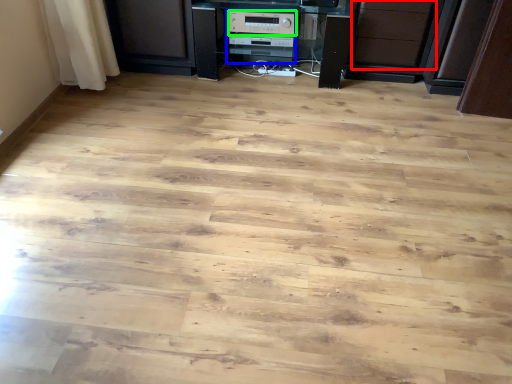
Question: Considering the real-world distances, which object is closest to drawer (highlighted by a red box)? appliance (highlighted by a blue box) or appliance (highlighted by a green box).

Choices:
 (A) appliance
 (B) appliance

Answer: (A)